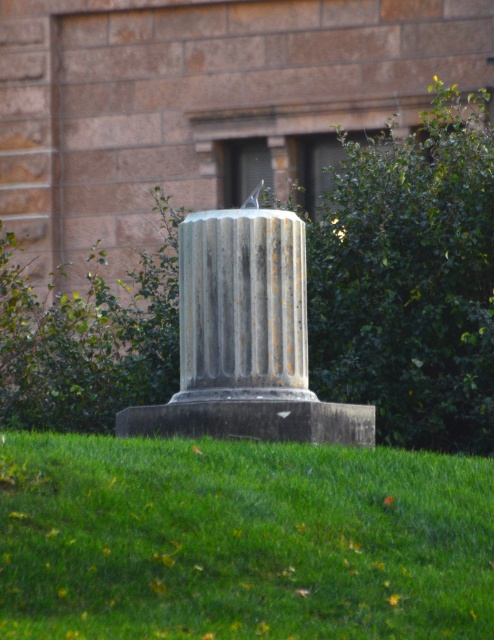
You are a gardener planning to water the green grass at center and the green leafy bush at center. The watering can you have can cover an area within 10 feet. Do you need to move the watering can to water both areas?

The green grass at center and green leafy bush at center are 21.62 feet apart, which is more than double the 10 feet coverage of the watering can. Therefore, you will need to move the watering can to water both areas.

In the scene shown: You are standing at the monument and want to place a small flag exactly at the point marked by the coordinates point (x=244, y=540). Based on the scene description, what will the flag be placed on?

The point (x=244, y=540) corresponds to green grass at center, so the flag will be placed on the green grass at center.